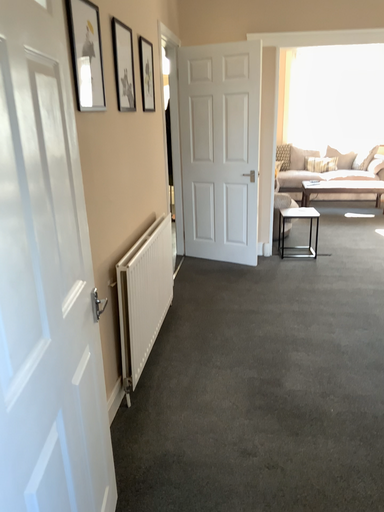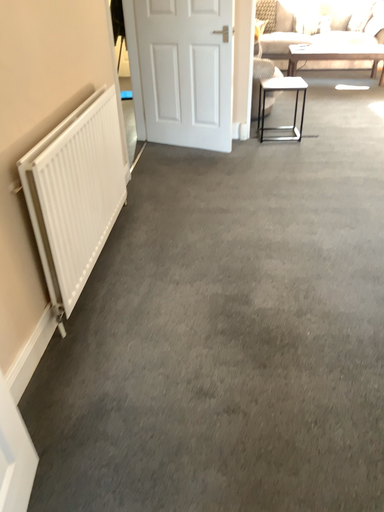
Question: How did the camera likely rotate when shooting the video?

Choices:
 (A) rotated upward
 (B) rotated downward

Answer: (B)